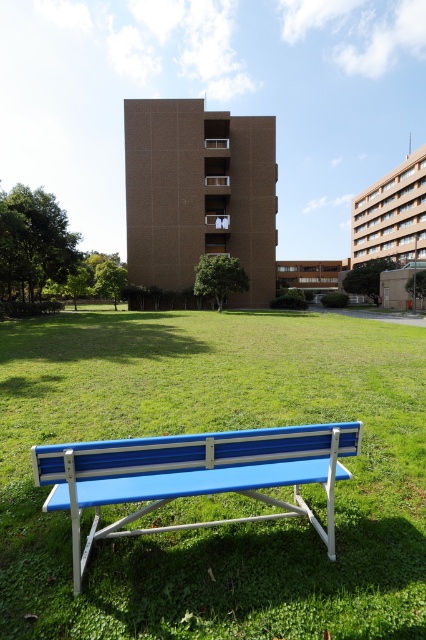
You are standing at the point with coordinates point (267, 480) and want to walk towards the point with coordinates point (37, 324). Will the large multi story brick building in the background block your path?

Point (37, 324) is behind point (267, 480), so the large multi story brick building in the background will block your path to point (37, 324).